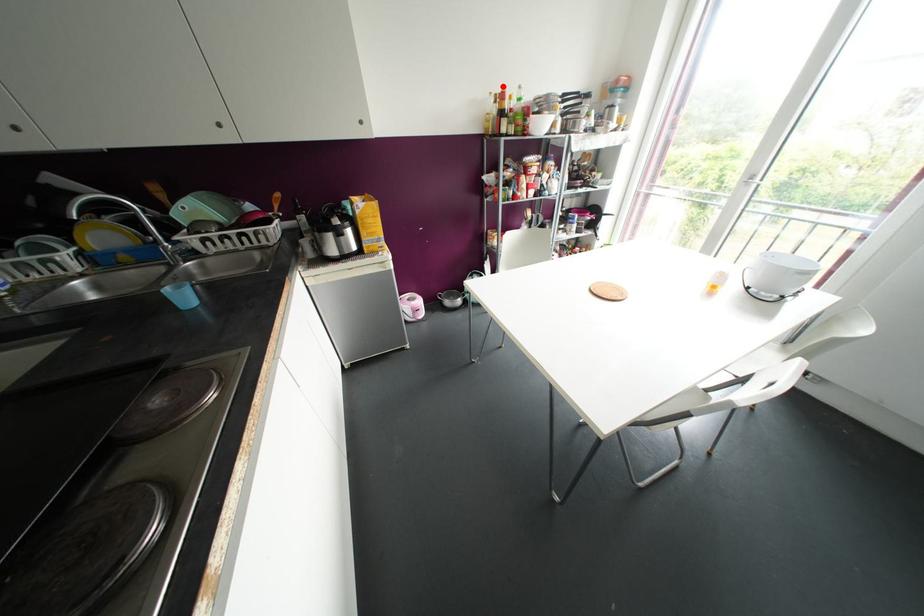
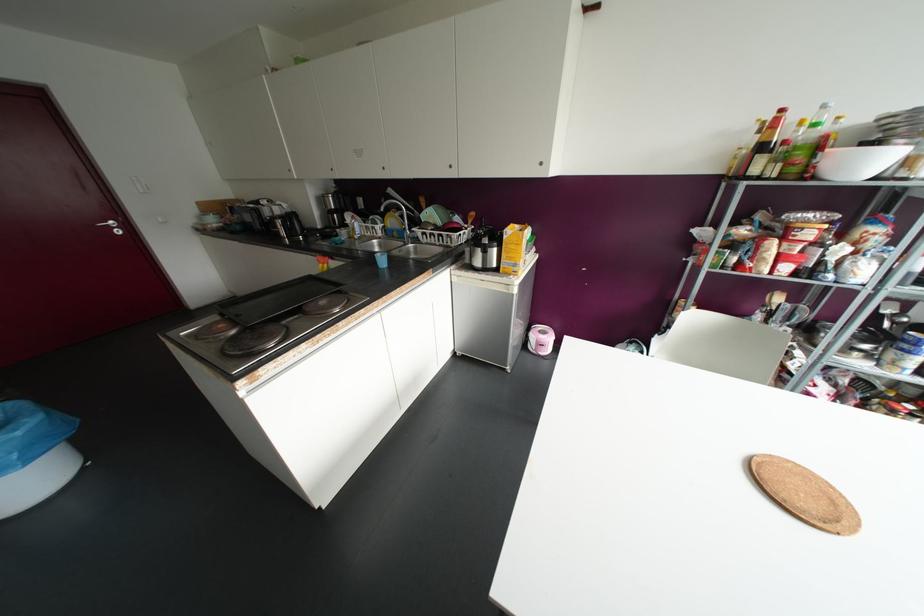
In the second image, find the point that corresponds to the highlighted location in the first image.

(781, 110)